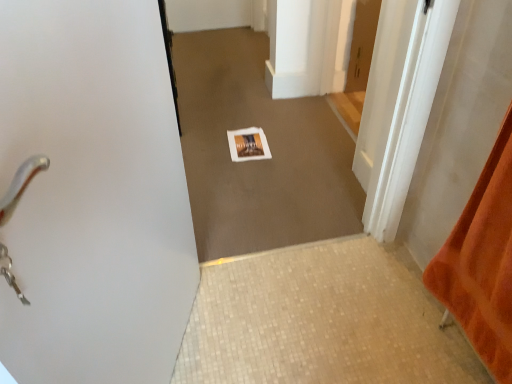
Question: From a real-world perspective, is wooden door at center, the first door when ordered from front to back, over orange fabric at right?

Choices:
 (A) yes
 (B) no

Answer: (B)

Question: Does wooden door at center, the first door when ordered from front to back, have a greater width compared to orange fabric at right?

Choices:
 (A) no
 (B) yes

Answer: (B)

Question: From a real-world perspective, is wooden door at center, arranged as the 2th door when viewed from the back, physically below orange fabric at right?

Choices:
 (A) yes
 (B) no

Answer: (A)

Question: Is wooden door at center, arranged as the 2th door when viewed from the back, with orange fabric at right?

Choices:
 (A) no
 (B) yes

Answer: (A)

Question: Is wooden door at center, arranged as the 2th door when viewed from the back, far away from orange fabric at right?

Choices:
 (A) no
 (B) yes

Answer: (A)

Question: Is wooden door at center, the first door when ordered from front to back, at the left side of orange fabric at right?

Choices:
 (A) yes
 (B) no

Answer: (A)

Question: Is beige mosaic tile at lower center at the right side of white paper at center?

Choices:
 (A) yes
 (B) no

Answer: (A)

Question: Is beige mosaic tile at lower center positioned in front of white paper at center?

Choices:
 (A) yes
 (B) no

Answer: (B)

Question: Is beige mosaic tile at lower center turned away from white paper at center?

Choices:
 (A) yes
 (B) no

Answer: (B)

Question: Can you confirm if beige mosaic tile at lower center is taller than white paper at center?

Choices:
 (A) yes
 (B) no

Answer: (B)

Question: From the image's perspective, is beige mosaic tile at lower center below white paper at center?

Choices:
 (A) no
 (B) yes

Answer: (B)

Question: Is beige mosaic tile at lower center facing towards white paper at center?

Choices:
 (A) yes
 (B) no

Answer: (B)

Question: Considering the relative positions of orange fabric at right and wooden door at center, the first door when ordered from front to back, in the image provided, is orange fabric at right to the left of wooden door at center, the first door when ordered from front to back, from the viewer's perspective?

Choices:
 (A) yes
 (B) no

Answer: (B)